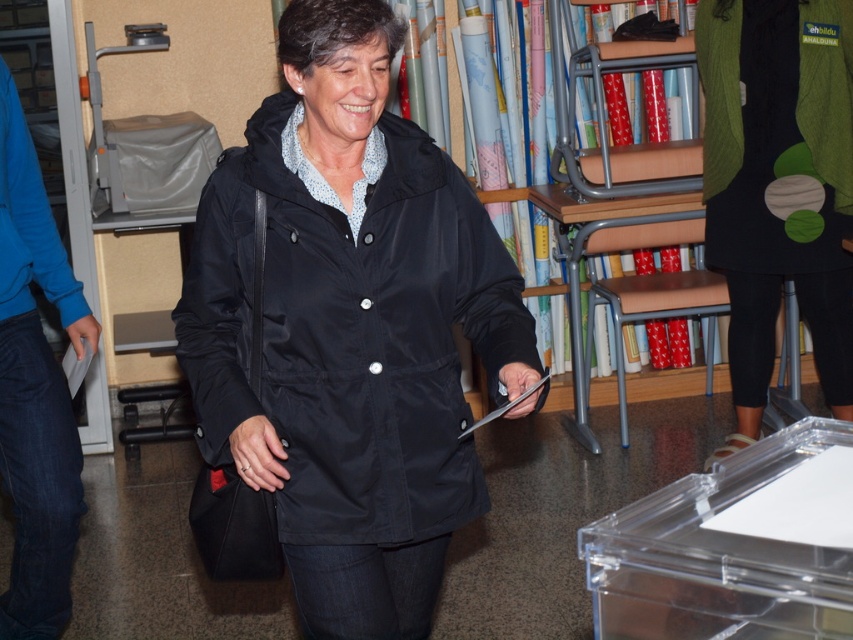
Question: Is matte black jacket at center closer to camera compared to green textured dress at right?

Choices:
 (A) no
 (B) yes

Answer: (B)

Question: Considering the relative positions of matte black jacket at center and green textured dress at right in the image provided, where is matte black jacket at center located with respect to green textured dress at right?

Choices:
 (A) right
 (B) left

Answer: (B)

Question: Can you confirm if matte black jacket at center is positioned above green textured dress at right?

Choices:
 (A) yes
 (B) no

Answer: (B)

Question: Which of the following is the farthest from the observer?

Choices:
 (A) green textured dress at right
 (B) matte black jacket at center

Answer: (A)